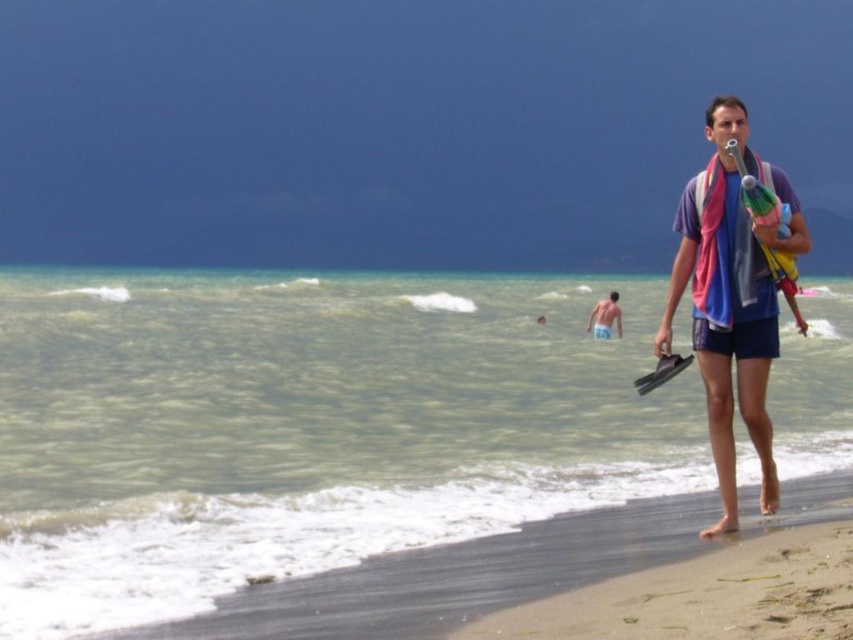
In the scene shown: Does blue cotton shorts at right have a greater width compared to brown sandy beach at lower right?

No, blue cotton shorts at right is not wider than brown sandy beach at lower right.

Does point (757, 376) lie in front of point (746, 552)?

That is False.

Between point (674, 224) and point (796, 636), which one is positioned in front?

Point (796, 636) is in front.

Where is `blue cotton shorts at right`? This screenshot has width=853, height=640. blue cotton shorts at right is located at coordinates (730, 300).

Is brown sandy beach at lower right shorter than light blue fabric at center?

Yes.

Describe the element at coordinates (704, 595) in the screenshot. I see `brown sandy beach at lower right` at that location.

This screenshot has width=853, height=640. What are the coordinates of `brown sandy beach at lower right` in the screenshot? It's located at (704, 595).

Who is taller, brown sandy beach at lower right or yellow rubber paddle at right?

With more height is yellow rubber paddle at right.

Between point (846, 570) and point (798, 326), which one is positioned in front?

Positioned in front is point (846, 570).

Does point (767, 586) come closer to viewer compared to point (788, 292)?

Yes, it is.

Where is `brown sandy beach at lower right`? This screenshot has height=640, width=853. brown sandy beach at lower right is located at coordinates (x=704, y=595).